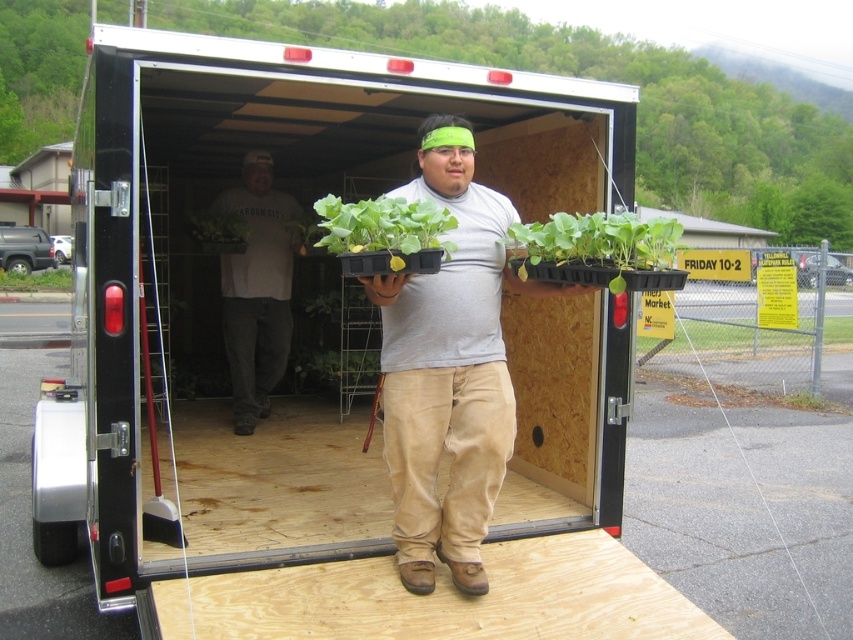
Between white cotton shirt at center and green leafy plant at center, which one has less height?

With less height is green leafy plant at center.

Is white cotton shirt at center to the left of green leafy plant at center from the viewer's perspective?

Incorrect, white cotton shirt at center is not on the left side of green leafy plant at center.

The image size is (853, 640). Identify the location of white cotton shirt at center. (257, 288).

Which is more to the right, green matte tray at center or green matte plant at center?

green matte tray at center

How much distance is there between green matte tray at center and green matte plant at center?

They are 2.49 meters apart.

Does point (398, 211) come closer to viewer compared to point (218, 224)?

Yes, point (398, 211) is in front of point (218, 224).

The width and height of the screenshot is (853, 640). Find the location of `green matte tray at center`. green matte tray at center is located at coordinates (384, 234).

From the picture: Can you confirm if black plastic trailer at center is shorter than green leafy plant at lower right?

No.

Locate an element on the screen. Image resolution: width=853 pixels, height=640 pixels. black plastic trailer at center is located at coordinates (238, 257).